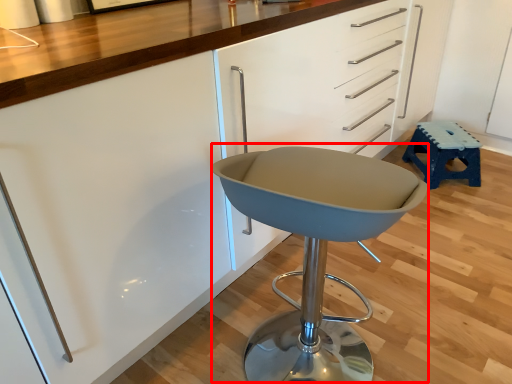
Question: In this image, where is swivel chair (annotated by the red box) located relative to stool?

Choices:
 (A) left
 (B) right

Answer: (A)